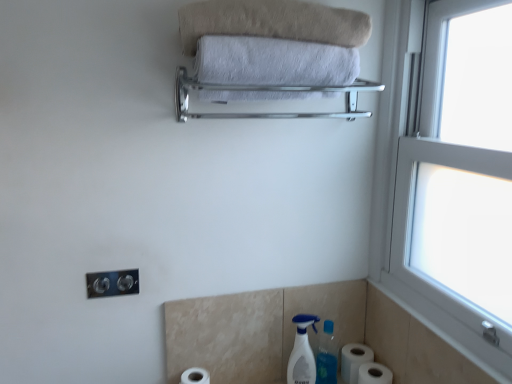
Question: Considering the positions of white plastic window at right and silver metallic towel rack at upper center in the image, is white plastic window at right wider or thinner than silver metallic towel rack at upper center?

Choices:
 (A) thin
 (B) wide

Answer: (A)

Question: Is white plastic window at right to the left or to the right of silver metallic towel rack at upper center in the image?

Choices:
 (A) left
 (B) right

Answer: (B)

Question: Which object is positioned farthest from the white matte toilet paper at lower right, acting as the 2th toilet paper starting from the right?

Choices:
 (A) white plastic window at right
 (B) white plastic spray bottle at lower center
 (C) white matte toilet paper at lower right, the third toilet paper viewed from the left
 (D) beige soft towel at upper center, which is the 1th towel from top to bottom
 (E) silver metallic towel rack at upper center

Answer: (D)

Question: Considering the real-world distances, which object is closest to the white plastic window at right?

Choices:
 (A) silver metallic towel rack at upper center
 (B) white matte toilet paper at lower right, which is the 2th toilet paper from left to right
 (C) satin nickel outlet at lower left
 (D) white matte toilet paper at lower center, the first toilet paper when ordered from left to right
 (E) beige soft towel at upper center, the 2th towel in the bottom-to-top sequence

Answer: (A)